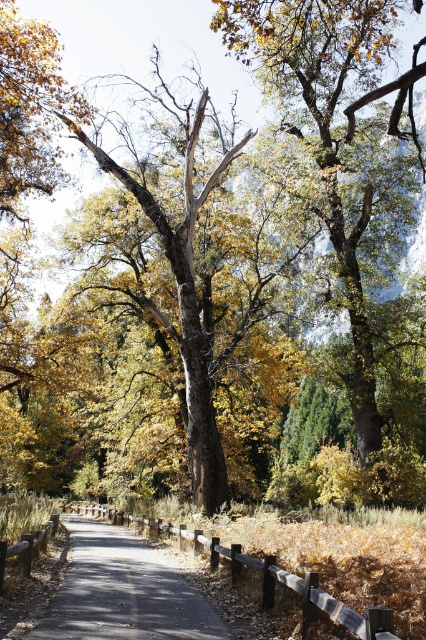
Question: Is green leafy tree at center smaller than smooth asphalt path at center?

Choices:
 (A) yes
 (B) no

Answer: (B)

Question: Among these points, which one is farthest from the camera?

Choices:
 (A) [x=129, y=564]
 (B) [x=302, y=51]

Answer: (B)

Question: Can you confirm if green leafy tree at center is positioned to the left of smooth asphalt path at center?

Choices:
 (A) yes
 (B) no

Answer: (B)

Question: Is green leafy tree at center positioned in front of smooth asphalt path at center?

Choices:
 (A) no
 (B) yes

Answer: (A)